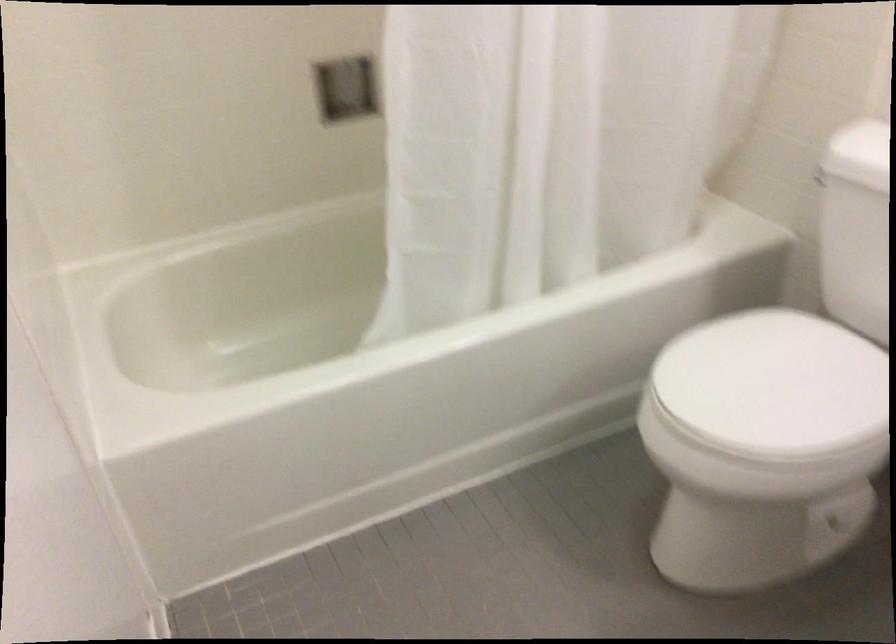
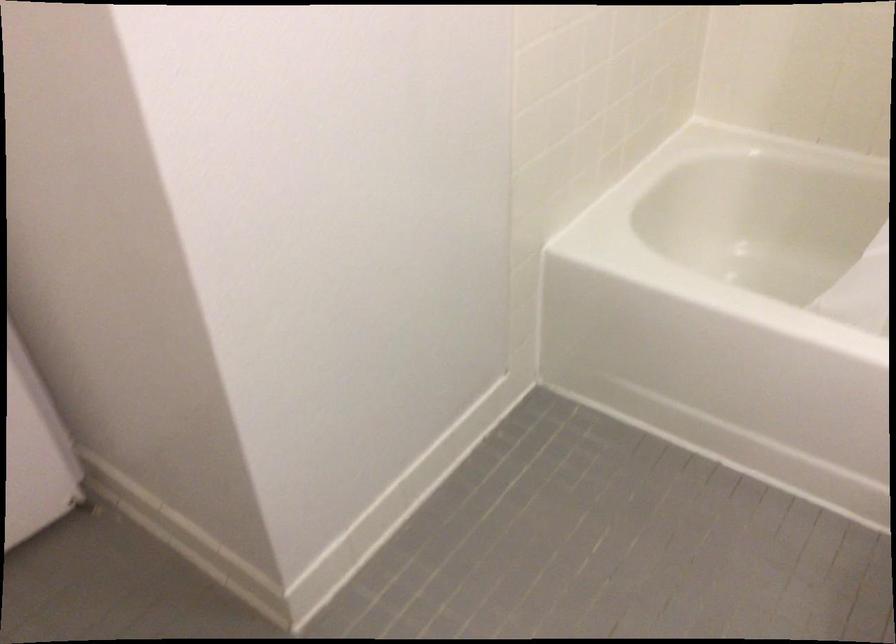
First-person continuous shooting, in which direction is the camera rotating?

The camera's rotation is toward left-down.